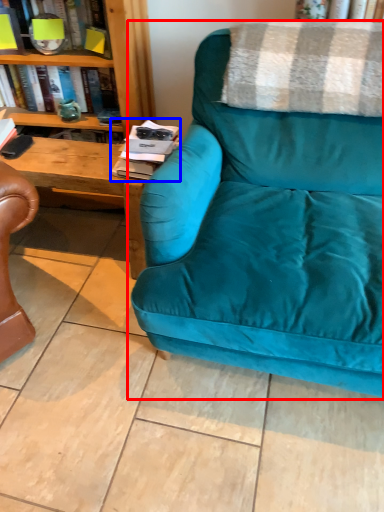
Question: Which of the following is the farthest to the observer, studio couch (highlighted by a red box) or magazine (highlighted by a blue box)?

Choices:
 (A) studio couch
 (B) magazine

Answer: (B)